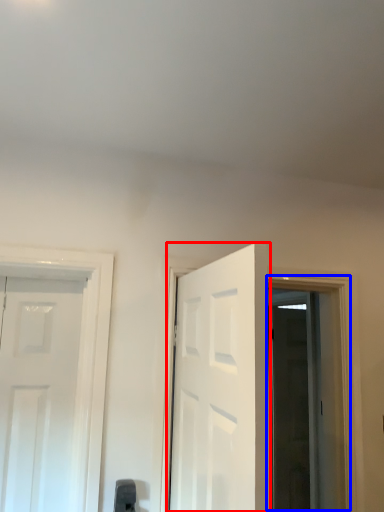
Question: Which point is closer to the camera, door (highlighted by a red box) or window (highlighted by a blue box)?

Choices:
 (A) door
 (B) window

Answer: (A)